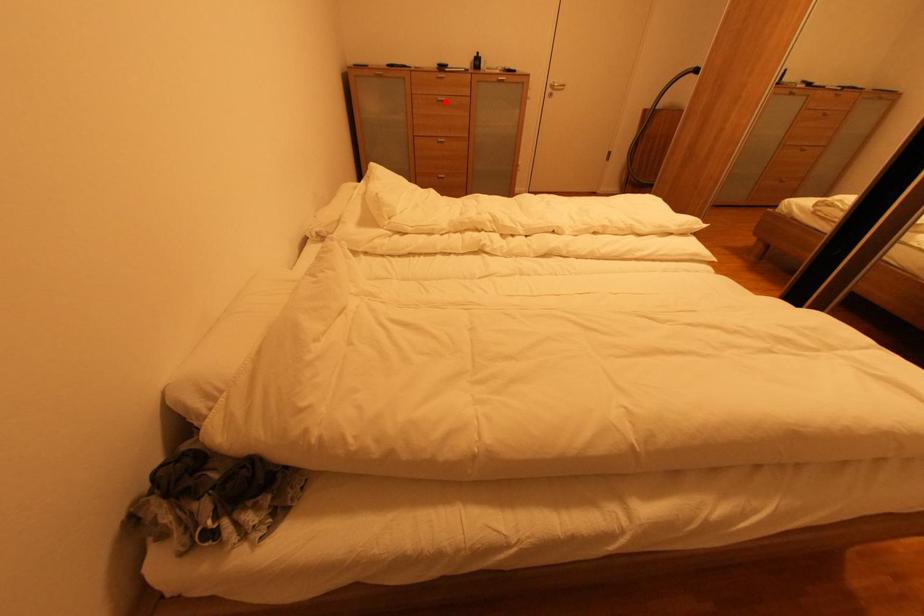
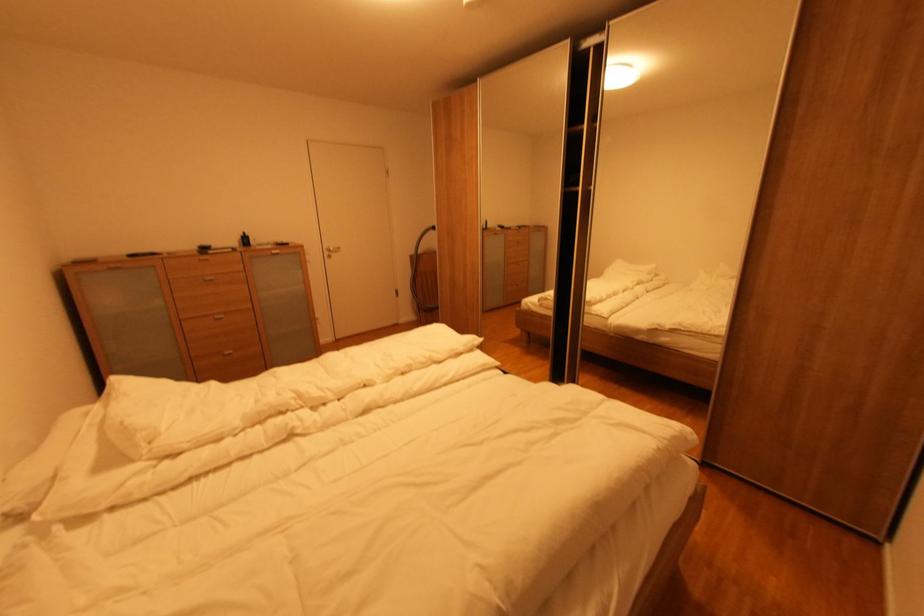
Question: I am providing you with two images of the same scene from different viewpoints. A red point is shown in image1. For the corresponding object point in image2, is it positioned nearer or farther from the camera?

Choices:
 (A) Nearer
 (B) Farther

Answer: (B)